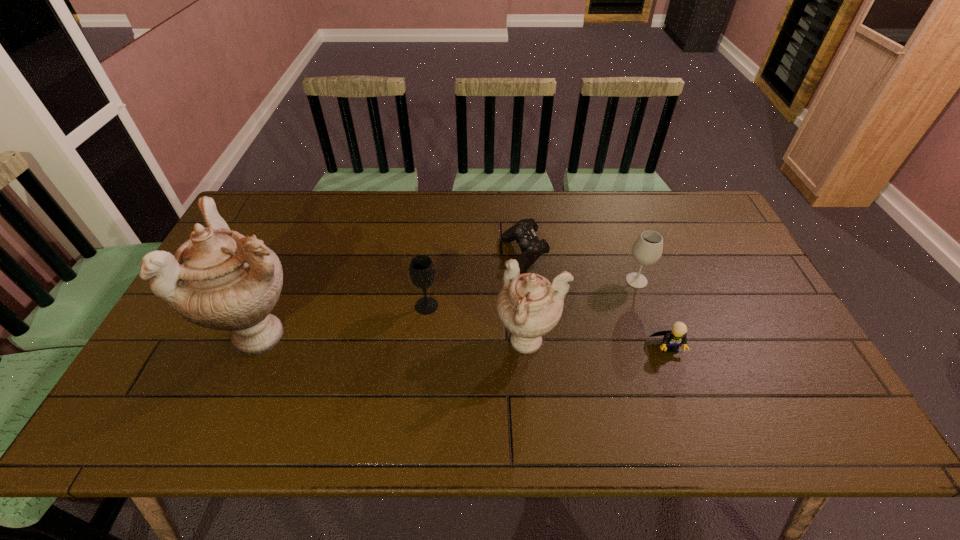
Locate an element on the screen. The height and width of the screenshot is (540, 960). free space located 0.180m on the left of the shorter urn is located at coordinates pos(425,343).

Locate an element on the screen. Image resolution: width=960 pixels, height=540 pixels. vacant space located on the left of the shortest object is located at coordinates (415, 255).

You are a GUI agent. You are given a task and a screenshot of the screen. Output one action in this format:
    pyautogui.click(x=<x>, y=<y>)
    Task: Click on the vacant space located on the left of the nearer wineglass
    The height and width of the screenshot is (540, 960).
    Given the screenshot: What is the action you would take?
    pyautogui.click(x=317, y=306)

This screenshot has width=960, height=540. Identify the location of vacant space positioned on the right of the right wineglass. (753, 281).

You are a GUI agent. You are given a task and a screenshot of the screen. Output one action in this format:
    pyautogui.click(x=<x>, y=<y>)
    Task: Click on the vacant space located on the front-facing side of the Lego
    The width and height of the screenshot is (960, 540).
    Given the screenshot: What is the action you would take?
    pyautogui.click(x=680, y=378)

Where is `object positioned at the left edge`? The image size is (960, 540). object positioned at the left edge is located at coordinates (219, 279).

Locate an element on the screen. Image resolution: width=960 pixels, height=540 pixels. object at the near left corner is located at coordinates (219, 279).

The width and height of the screenshot is (960, 540). Find the location of `vacant space at the far edge`. vacant space at the far edge is located at coordinates (583, 200).

I want to click on free space at the near edge of the desktop, so (x=281, y=394).

At what (x,y) coordinates should I click in order to perform the action: click on vacant space at the left edge of the desktop. Please return your answer as a coordinate pair (x, y). Looking at the image, I should click on (166, 339).